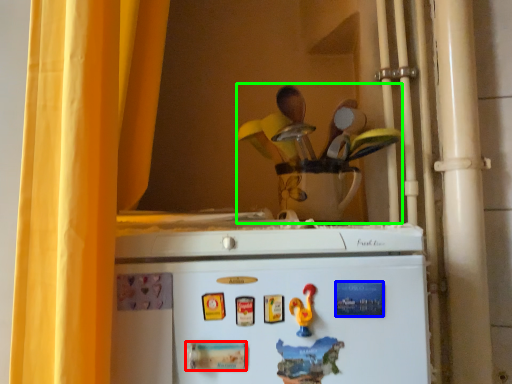
Question: Which is farther away from magnet (highlighted by a red box)? magnet (highlighted by a blue box) or toy (highlighted by a green box)?

Choices:
 (A) magnet
 (B) toy

Answer: (B)